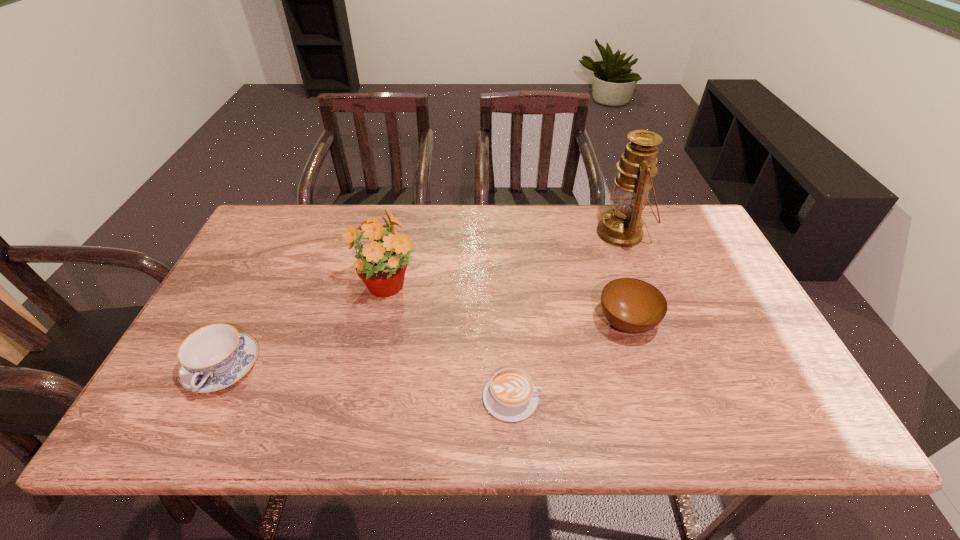
The width and height of the screenshot is (960, 540). I want to click on oil lamp, so click(621, 226).

Locate an element on the screen. The image size is (960, 540). the farthest object is located at coordinates (621, 226).

The height and width of the screenshot is (540, 960). In order to click on flowerpot in this screenshot , I will do `click(383, 262)`.

Identify the location of the fourth shortest object. The image size is (960, 540). (383, 262).

The height and width of the screenshot is (540, 960). Identify the location of bowl. (634, 306).

At what (x,y) coordinates should I click in order to perform the action: click on the leftmost object. Please return your answer as a coordinate pair (x, y). Looking at the image, I should click on (214, 357).

Identify the location of the third object from left to right. (510, 395).

Locate an element on the screen. This screenshot has width=960, height=540. cappuccino is located at coordinates (510, 395).

You are a GUI agent. You are given a task and a screenshot of the screen. Output one action in this format:
    pyautogui.click(x=<x>, y=<y>)
    Task: Click on the free region located 0.220m on the left of the farthest object
    This screenshot has height=540, width=960.
    Given the screenshot: What is the action you would take?
    pyautogui.click(x=527, y=233)

This screenshot has width=960, height=540. Find the location of `vacant space located on the front of the second object from left to right`. vacant space located on the front of the second object from left to right is located at coordinates tap(363, 413).